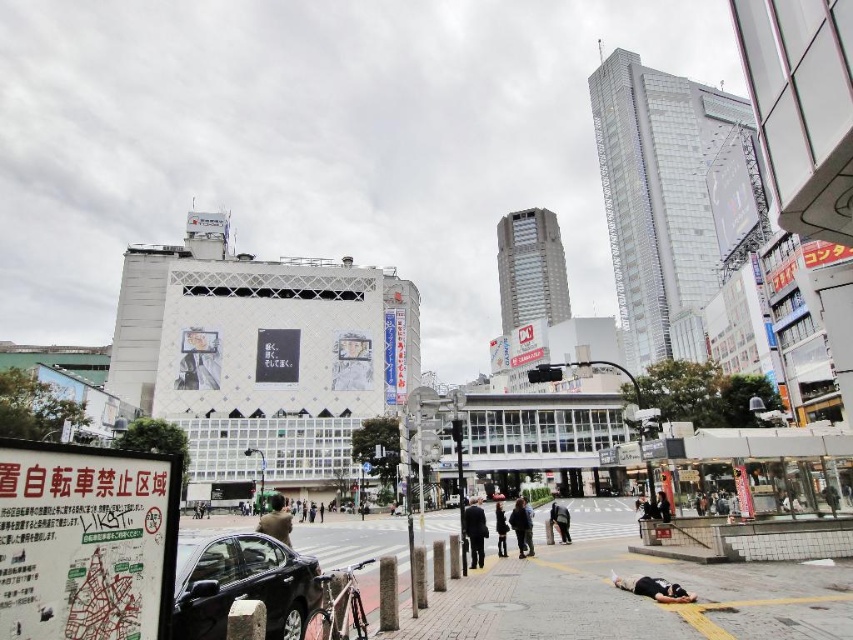
You are a pedestrian at the crosswalk in the scene. You see a dark gray suit at center and a dark gray fabric coat at center. Which one is closer to you?

The dark gray suit at center is closer to you because it is in front of the dark gray fabric coat at center.

You are a pedestrian on the street and you see the dark gray fabric coat at center and the dark gray fabric bag at lower center. Which object is higher up from the ground?

The dark gray fabric coat at center is above the dark gray fabric bag at lower center, so the dark gray fabric coat at center is higher up from the ground.

You are a delivery person who needs to carry both the dark gray fabric coat at center and the dark gray fabric bag at lower center. Which item can fit into a narrow alleyway more easily?

The dark gray fabric coat at center is thinner than the dark gray fabric bag at lower center, so it can fit into the narrow alleyway more easily.